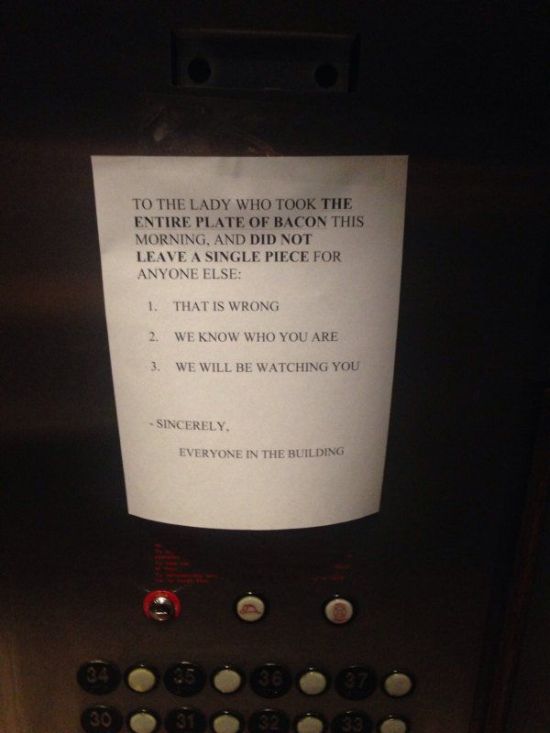
In order to click on emergency buttons in this screenshot , I will do `click(342, 611)`, `click(252, 607)`, `click(161, 605)`.